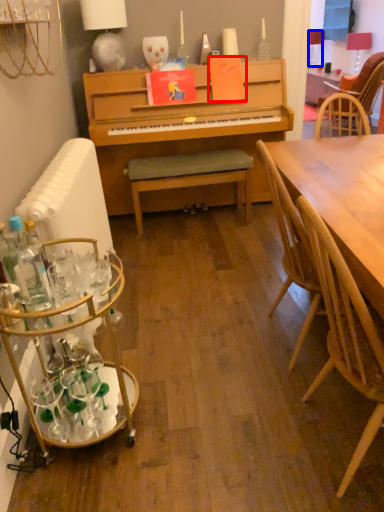
Question: Which of the following is the closest to the observer, book (highlighted by a red box) or lamp (highlighted by a blue box)?

Choices:
 (A) book
 (B) lamp

Answer: (A)